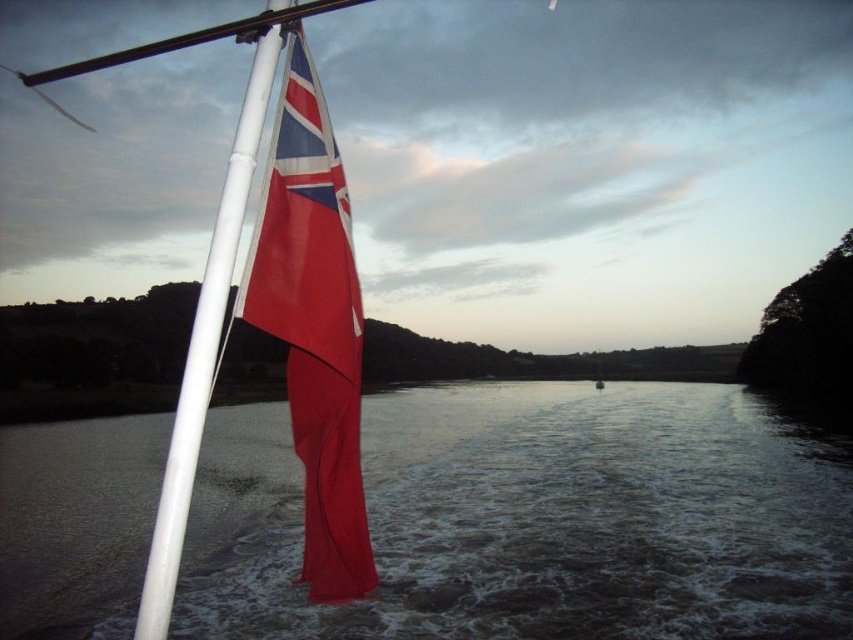
You are standing on the boat and looking down. Where is the smooth water at lower left located in terms of coordinates?

The smooth water at lower left is located at coordinates point (537, 518).

What is the location of the point with coordinates (312, 324) in the image?

The point with coordinates (312, 324) is located on the textured fabric flag at left.

You are a sailor on a boat and need to adjust the flag. Which object is closer to you, the textured fabric flag at left or the white glossy flag pole at upper left?

The textured fabric flag at left is closer to you than the white glossy flag pole at upper left because it is further to the viewer.